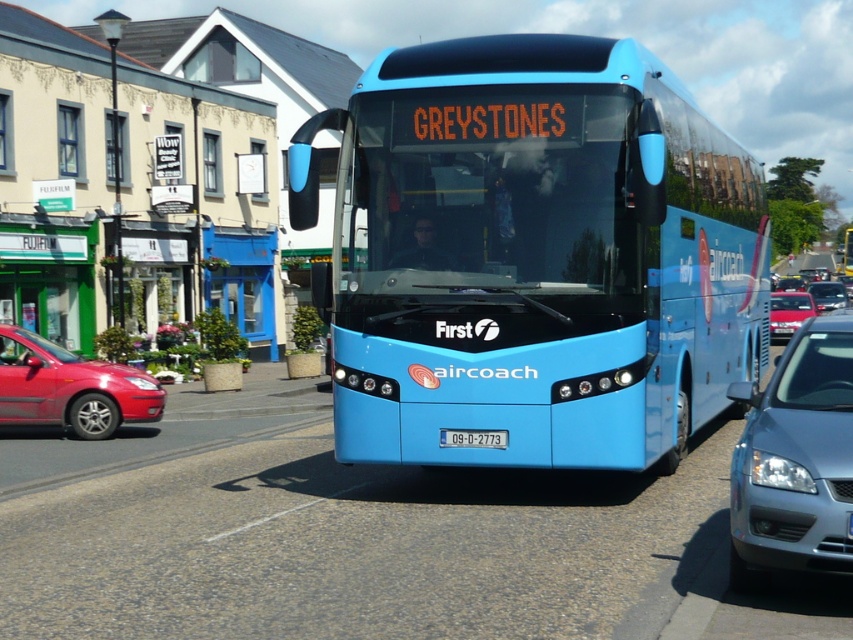
Who is lower down, blue glossy bus at center or white plastic license plate at center?

white plastic license plate at center is lower down.

Is blue glossy bus at center to the right of white plastic license plate at center from the viewer's perspective?

No, blue glossy bus at center is not to the right of white plastic license plate at center.

Which is behind, point (381, 234) or point (450, 428)?

Positioned behind is point (381, 234).

Locate an element on the screen. blue glossy bus at center is located at coordinates (534, 256).

Between point (90, 292) and point (827, 296), which one is positioned behind?

The point (827, 296) is more distant.

Where is `matte blue bus at center`? The image size is (853, 640). matte blue bus at center is located at coordinates (48, 276).

Can you confirm if blue glossy bus at center is positioned to the left of metallic silver sedan at right?

Correct, you'll find blue glossy bus at center to the left of metallic silver sedan at right.

Does blue glossy bus at center come behind metallic silver sedan at right?

No, blue glossy bus at center is in front of metallic silver sedan at right.

What do you see at coordinates (534, 256) in the screenshot? I see `blue glossy bus at center` at bounding box center [534, 256].

Image resolution: width=853 pixels, height=640 pixels. I want to click on blue glossy bus at center, so click(x=534, y=256).